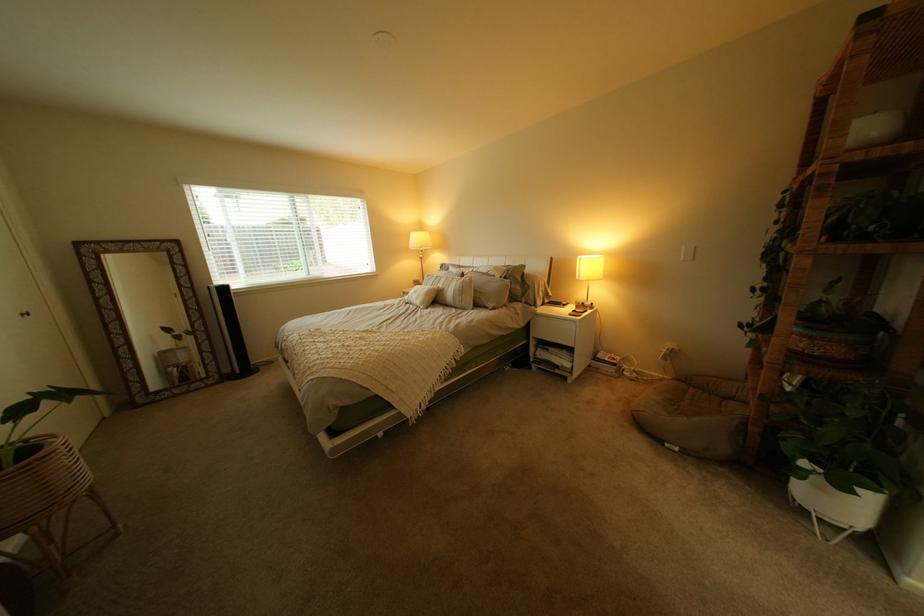
The width and height of the screenshot is (924, 616). Describe the element at coordinates (21, 317) in the screenshot. I see `the door knob` at that location.